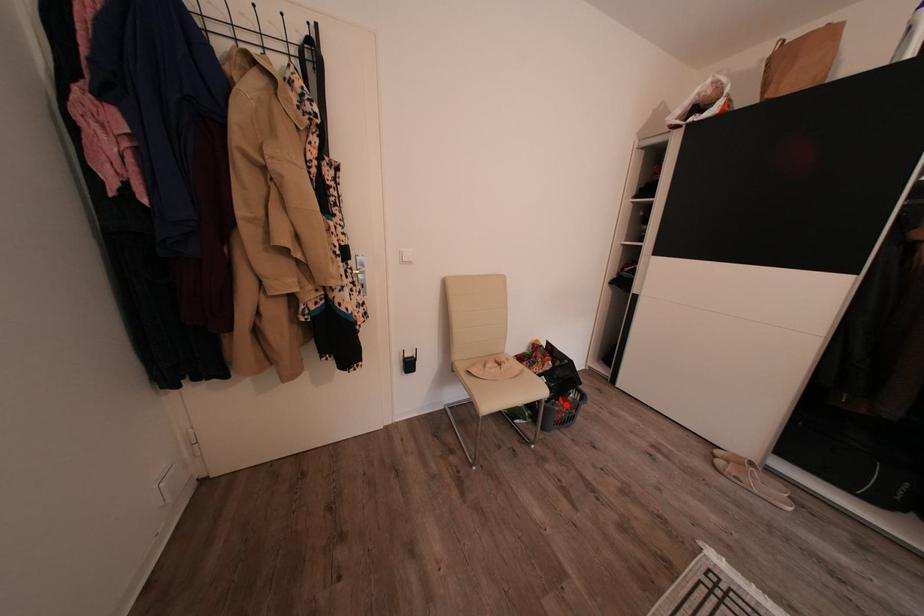
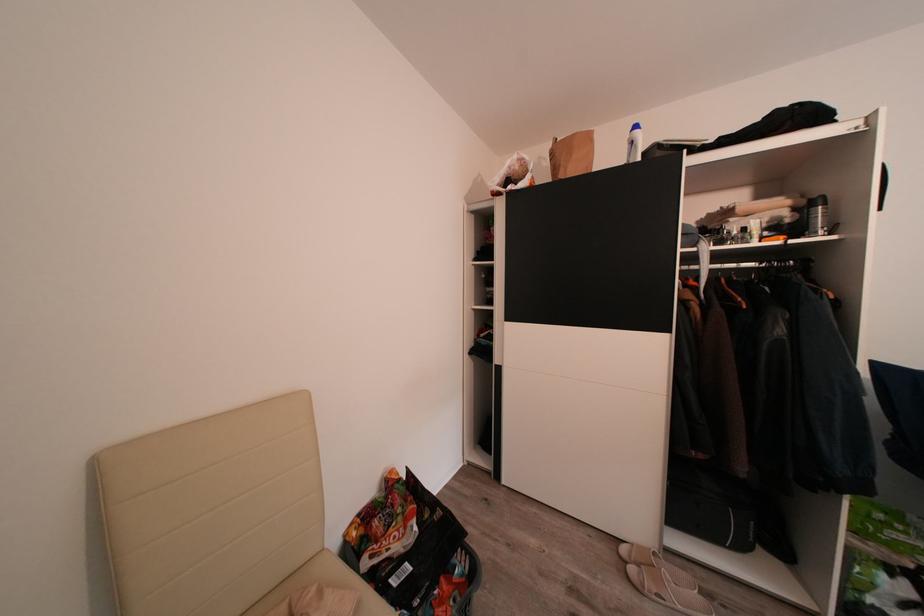
Question: I am providing you with two images of the same scene from different viewpoints. Given a red point in image1, look at the same physical point in image2. Is it:

Choices:
 (A) Closer to the viewpoint
 (B) Farther from the viewpoint

Answer: (A)